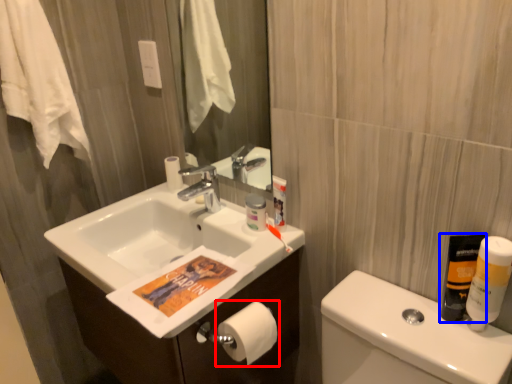
Question: Which object appears farthest to the camera in this image, toilet paper (highlighted by a red box) or mouthwash (highlighted by a blue box)?

Choices:
 (A) toilet paper
 (B) mouthwash

Answer: (A)